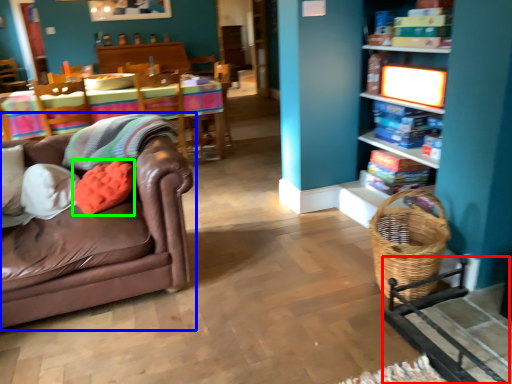
Question: Based on their relative distances, which object is nearer to rocking chair (highlighted by a red box)? Choose from studio couch (highlighted by a blue box) and pillow (highlighted by a green box).

Choices:
 (A) studio couch
 (B) pillow

Answer: (A)